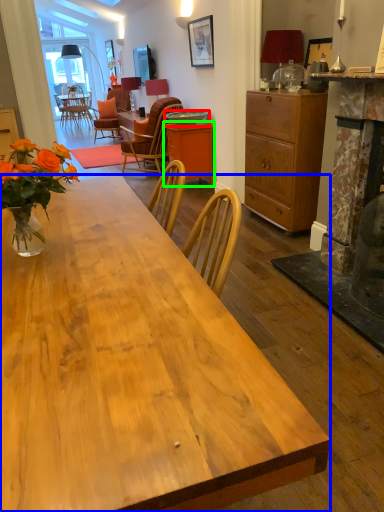
Question: Which object is positioned farthest from round table (highlighted by a red box)? Select from desk (highlighted by a blue box) and cabinetry (highlighted by a green box).

Choices:
 (A) desk
 (B) cabinetry

Answer: (A)